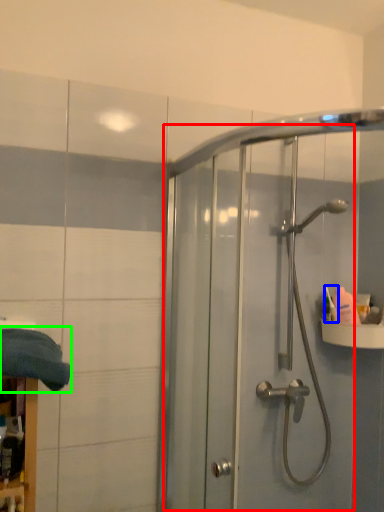
Question: Which object is positioned farthest from screen door (highlighted by a red box)? Select from toiletry (highlighted by a blue box) and bath towel (highlighted by a green box).

Choices:
 (A) toiletry
 (B) bath towel

Answer: (B)